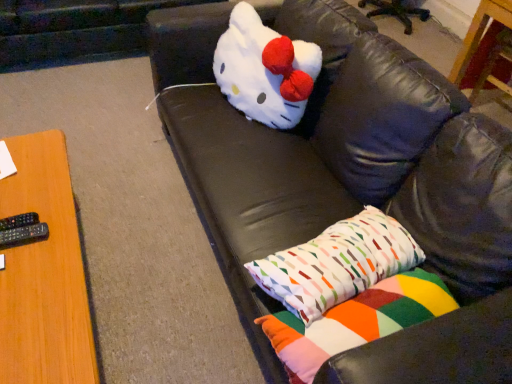
Locate an element on the screen. free space to the right of black plastic remote at left, which is counted as the first remote, starting from the top is located at coordinates (52, 239).